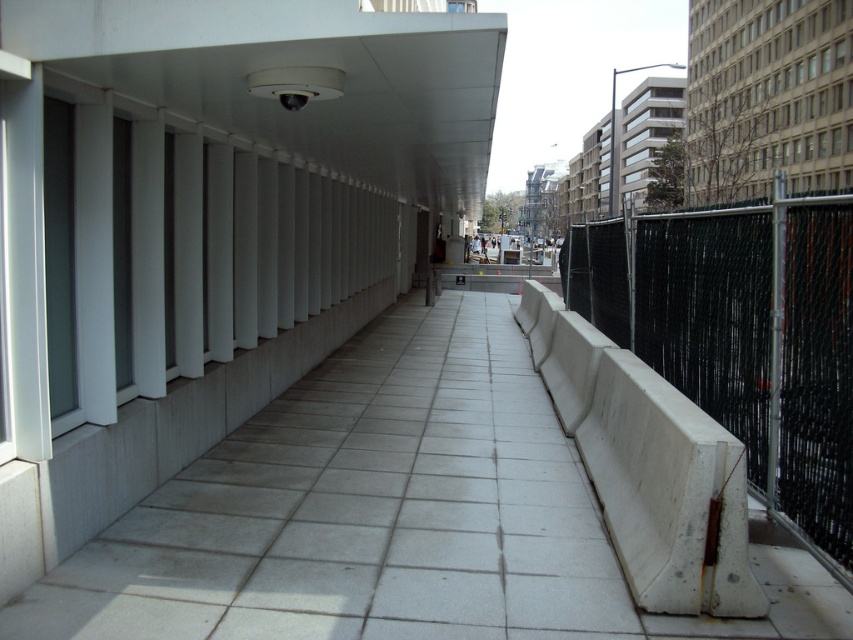
Is black chain-link fence at right further to camera compared to white concrete barrier at right?

Yes, it is.

Is black chain-link fence at right taller than white concrete barrier at right?

Correct, black chain-link fence at right is much taller as white concrete barrier at right.

Identify the location of black chain-link fence at right. (743, 336).